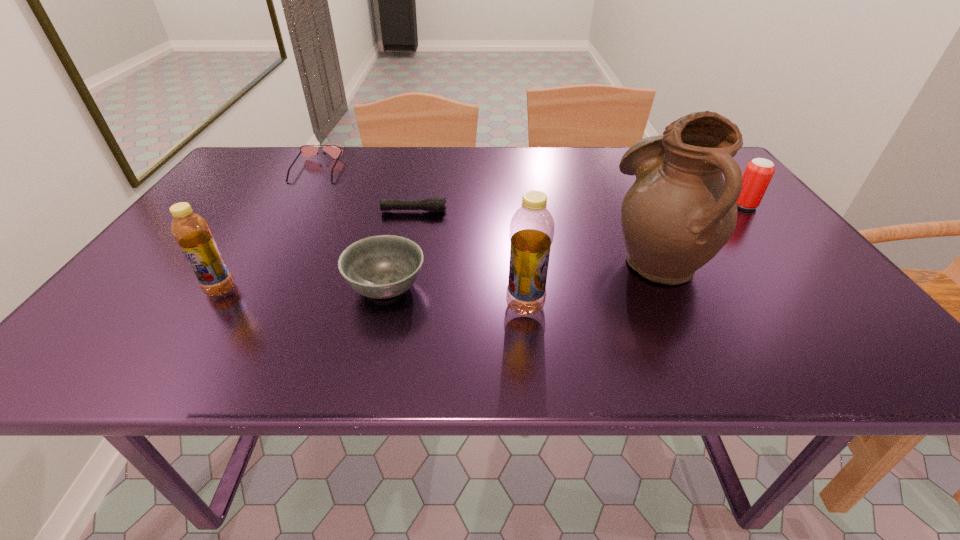
Find the location of a particular element. free location located on the back of the third shortest object is located at coordinates (412, 182).

Find the location of a particular element. The height and width of the screenshot is (540, 960). object present at the far edge is located at coordinates (305, 150).

Find the location of `pitcher positioned at the near edge`. pitcher positioned at the near edge is located at coordinates click(679, 213).

At what (x,y) coordinates should I click in order to perform the action: click on bowl located at the near edge. Please return your answer as a coordinate pair (x, y). This screenshot has height=540, width=960. Looking at the image, I should click on (384, 266).

I want to click on object present at the right edge, so click(x=758, y=173).

The image size is (960, 540). I want to click on vacant space at the far edge of the desktop, so click(487, 150).

Where is `free space at the near edge`? The image size is (960, 540). free space at the near edge is located at coordinates (497, 307).

Find the location of a particular element. The image size is (960, 540). free location at the left edge of the desktop is located at coordinates (239, 216).

Where is `vacant space at the right edge of the desktop`? vacant space at the right edge of the desktop is located at coordinates (800, 256).

The height and width of the screenshot is (540, 960). Find the location of `vacant point at the far left corner`. vacant point at the far left corner is located at coordinates (274, 177).